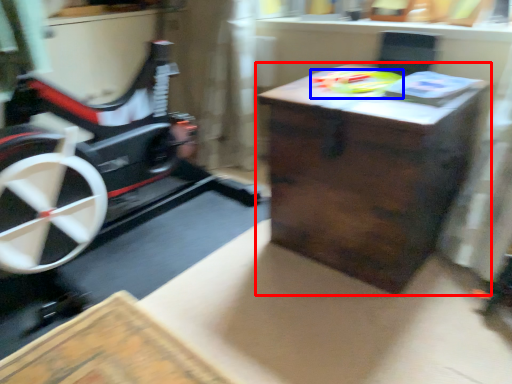
Question: Among these objects, which one is nearest to the camera, table (highlighted by a red box) or toy (highlighted by a blue box)?

Choices:
 (A) table
 (B) toy

Answer: (A)